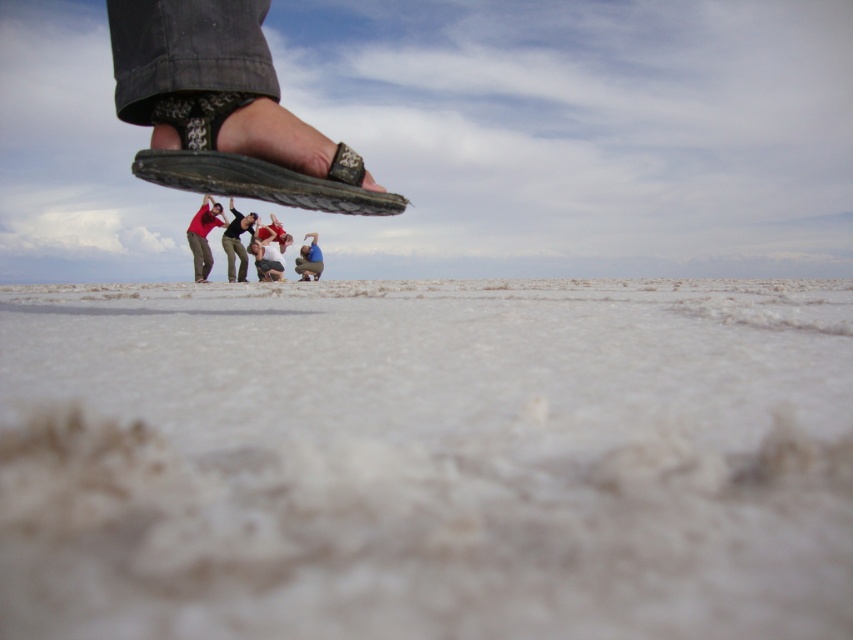
Question: Which is nearer to the dark gray pants at lower center?

Choices:
 (A) white sandy ground at lower center
 (B) matte red shirt at upper center
 (C) black leather sandal at upper center

Answer: (B)

Question: Is matte black sandal at upper center behind matte blue shirt at lower center?

Choices:
 (A) no
 (B) yes

Answer: (A)

Question: Is white sandy ground at lower center below matte black sandal at upper center?

Choices:
 (A) yes
 (B) no

Answer: (A)

Question: Which point is farther to the camera?

Choices:
 (A) matte blue shirt at lower center
 (B) matte red shirt at center
 (C) matte red shirt at upper center

Answer: (B)

Question: Where is matte black sandal at upper center located in relation to matte red shirt at upper center in the image?

Choices:
 (A) right
 (B) left

Answer: (A)

Question: Estimate the real-world distances between objects in this image. Which object is farther from the matte red shirt at center?

Choices:
 (A) black leather sandal at upper center
 (B) dark gray pants at lower center

Answer: (A)